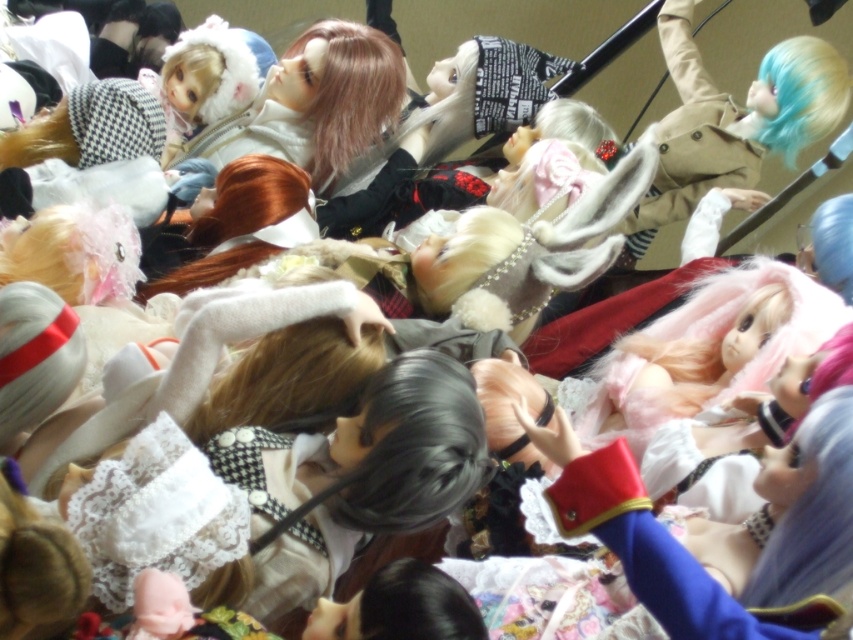
Question: Is fluffy white hair at center in front of blonde silky wig at upper left?

Choices:
 (A) no
 (B) yes

Answer: (B)

Question: Is blue silky hair at upper right wider than blonde silky wig at upper left?

Choices:
 (A) yes
 (B) no

Answer: (B)

Question: Which point appears closest to the camera in this image?

Choices:
 (A) (838, 60)
 (B) (500, 236)

Answer: (B)

Question: Which point appears closest to the camera in this image?

Choices:
 (A) (784, 148)
 (B) (413, 630)
 (C) (202, 77)

Answer: (B)

Question: Does black silky hair at center have a smaller size compared to white silky hair at center?

Choices:
 (A) yes
 (B) no

Answer: (A)

Question: Which point is farther to the camera?

Choices:
 (A) (171, 60)
 (B) (833, 224)
 (C) (469, 243)

Answer: (A)